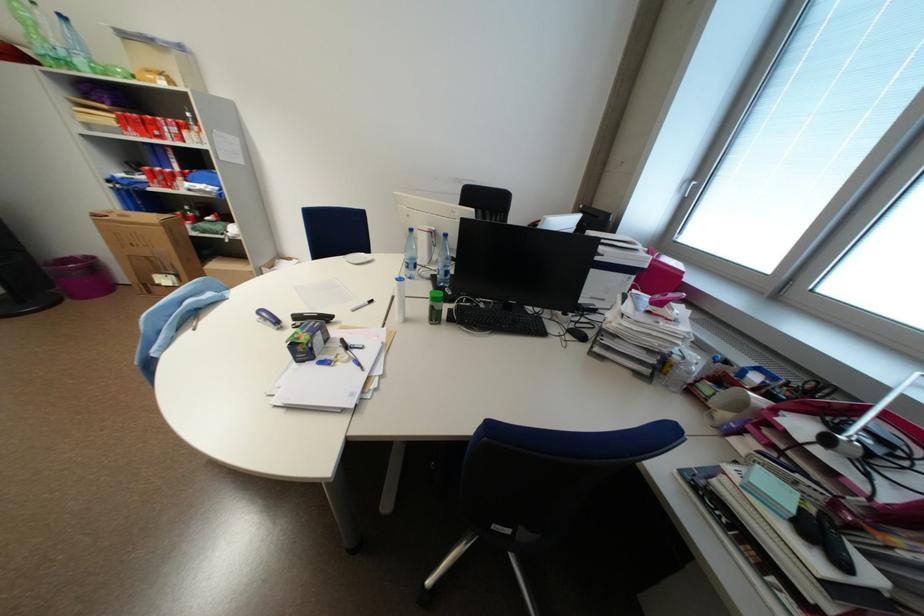
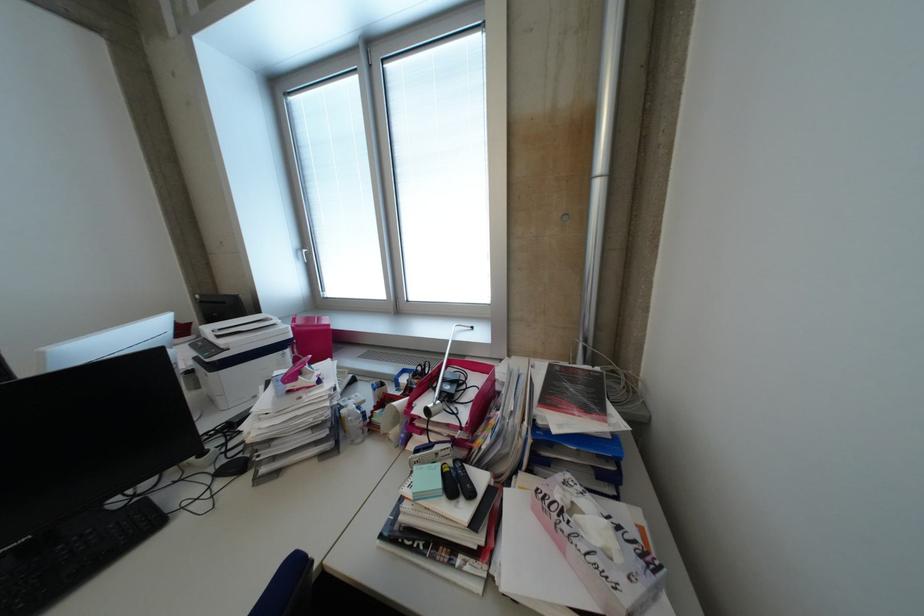
The point at (685, 359) is marked in the first image. Where is the corresponding point in the second image?

(351, 413)